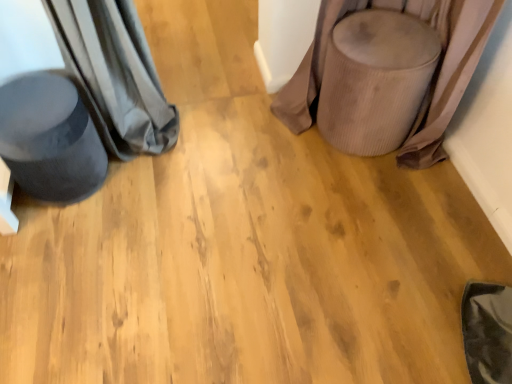
Question: Considering the positions of point (392, 142) and point (24, 120), is point (392, 142) closer or farther from the camera than point (24, 120)?

Choices:
 (A) closer
 (B) farther

Answer: (B)

Question: Is velvet beige stool at right, arranged as the first swivel chair when viewed from the right, inside or outside of velvet dark grey swivel chair at left, which is the second swivel chair in right-to-left order?

Choices:
 (A) outside
 (B) inside

Answer: (A)

Question: From the image's perspective, is velvet beige stool at right, acting as the 2th swivel chair starting from the left, positioned above or below velvet dark grey swivel chair at left, which is the 1th swivel chair in left-to-right order?

Choices:
 (A) below
 (B) above

Answer: (B)

Question: Visually, is velvet dark grey swivel chair at left, which is the 1th swivel chair in left-to-right order, positioned to the left or to the right of velvet beige stool at right, arranged as the first swivel chair when viewed from the right?

Choices:
 (A) left
 (B) right

Answer: (A)

Question: From the image's perspective, is velvet dark grey swivel chair at left, which is the second swivel chair in right-to-left order, above or below velvet beige stool at right, acting as the 2th swivel chair starting from the left?

Choices:
 (A) above
 (B) below

Answer: (B)

Question: Considering the positions of point (53, 150) and point (408, 122), is point (53, 150) closer or farther from the camera than point (408, 122)?

Choices:
 (A) closer
 (B) farther

Answer: (A)

Question: Based on their sizes in the image, would you say velvet dark grey swivel chair at left, which is the second swivel chair in right-to-left order, is bigger or smaller than velvet beige stool at right, arranged as the first swivel chair when viewed from the right?

Choices:
 (A) big
 (B) small

Answer: (B)